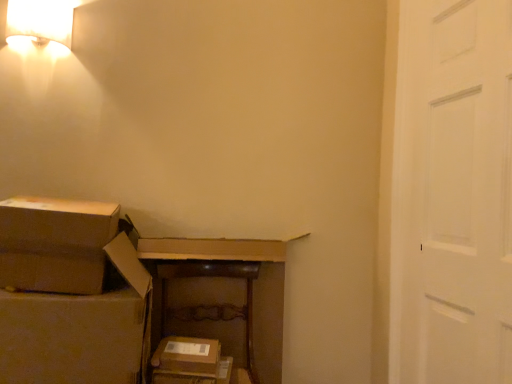
Question: Is brown cardboard box at left, the second storage box positioned from the right, in front of or behind white fabric lampshade at upper left in the image?

Choices:
 (A) front
 (B) behind

Answer: (A)

Question: Does point (47, 380) appear closer or farther from the camera than point (69, 14)?

Choices:
 (A) closer
 (B) farther

Answer: (A)

Question: Estimate the real-world distances between objects in this image. Which object is farther from the brown cardboard box at lower left?

Choices:
 (A) brown cardboard box at left, the first storage box from the left
 (B) brown wooden dresser at center
 (C) white painted wood door at right
 (D) brown cardboard box at center, positioned as the first storage box in bottom-to-top order
 (E) white fabric lampshade at upper left

Answer: (C)

Question: Considering the real-world distances, which object is farthest from the brown cardboard box at lower left?

Choices:
 (A) white fabric lampshade at upper left
 (B) brown cardboard box at left, which is counted as the second storage box, starting from the bottom
 (C) brown cardboard box at center, placed as the 2th storage box when sorted from left to right
 (D) white painted wood door at right
 (E) brown wooden dresser at center

Answer: (D)